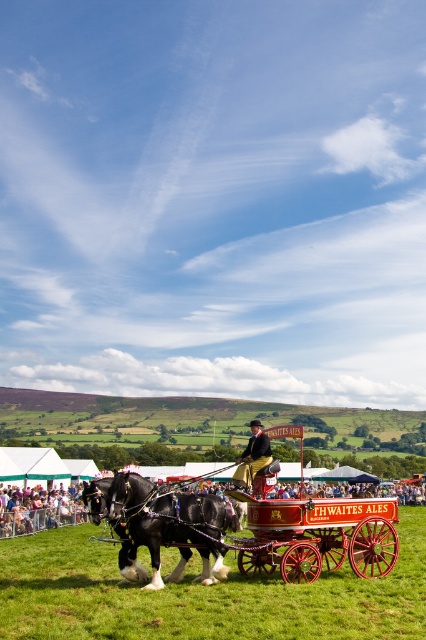
Can you confirm if red polished wood horse cart at center is wider than shiny black horse at center?

Yes, red polished wood horse cart at center is wider than shiny black horse at center.

Does red polished wood horse cart at center have a smaller size compared to shiny black horse at center?

Incorrect, red polished wood horse cart at center is not smaller in size than shiny black horse at center.

Image resolution: width=426 pixels, height=640 pixels. In order to click on red polished wood horse cart at center in this screenshot , I will do `click(316, 536)`.

Measure the distance between red polished wood horse cart at center and smooth brown leather jacket at center.

red polished wood horse cart at center is 2.26 meters from smooth brown leather jacket at center.

Where is `red polished wood horse cart at center`? Image resolution: width=426 pixels, height=640 pixels. red polished wood horse cart at center is located at coordinates (316, 536).

Locate an element on the screen. red polished wood horse cart at center is located at coordinates (316, 536).

Find the location of a particular element. This screenshot has height=640, width=426. red polished wood horse cart at center is located at coordinates (316, 536).

Is green grassy field at center to the right of smooth skin person at lower left from the viewer's perspective?

Indeed, green grassy field at center is positioned on the right side of smooth skin person at lower left.

Is green grassy field at center behind smooth skin person at lower left?

No, green grassy field at center is closer to the viewer.

Where is `green grassy field at center`? This screenshot has height=640, width=426. green grassy field at center is located at coordinates coord(201,595).